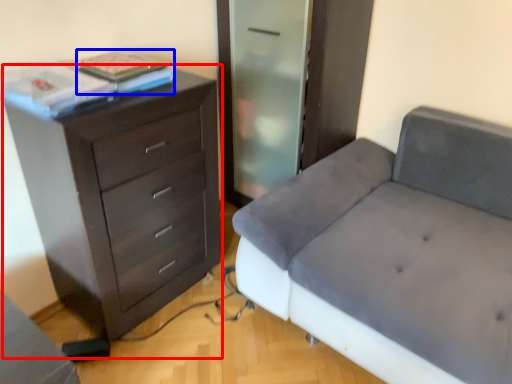
Question: Which object appears farthest to the camera in this image, chest of drawers (highlighted by a red box) or book (highlighted by a blue box)?

Choices:
 (A) chest of drawers
 (B) book

Answer: (B)